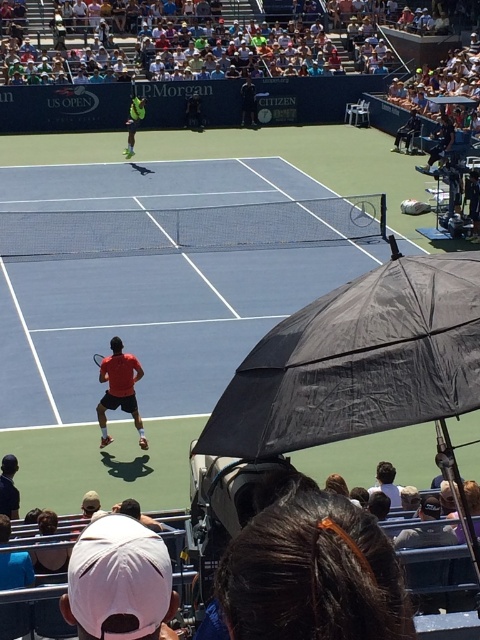
Question: Does red matte tennis player at lower left have a larger size compared to dark blue fabric wheelchair at upper right?

Choices:
 (A) no
 (B) yes

Answer: (A)

Question: Which point appears closest to the camera in this image?

Choices:
 (A) (398, 138)
 (B) (103, 360)
 (C) (31, 554)

Answer: (C)

Question: Which of the following is the closest to the observer?

Choices:
 (A) (370, 209)
 (B) (9, 468)
 (C) (250, 120)

Answer: (B)

Question: Can you confirm if red matte tennis player at lower left is positioned below black rubber tennis racket at center?

Choices:
 (A) no
 (B) yes

Answer: (B)

Question: Is dark blue shirt at lower left positioned at the back of green fabric tennis outfit at upper center?

Choices:
 (A) no
 (B) yes

Answer: (A)

Question: Which of these objects is positioned farthest from the matte black racket at center?

Choices:
 (A) black rubber tennis racket at center
 (B) dark blue shirt at center
 (C) dark blue fabric wheelchair at upper right
 (D) brown hair at lower center

Answer: (B)